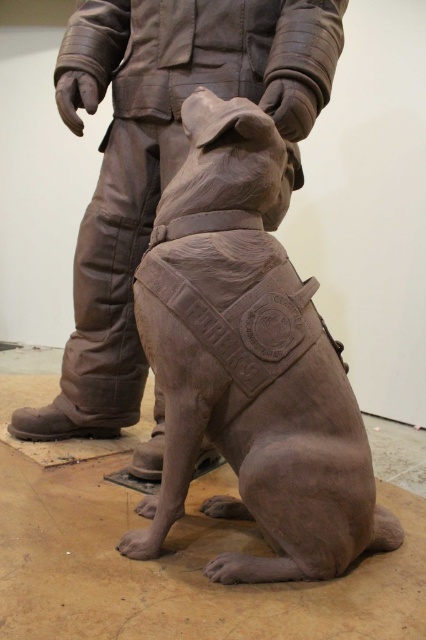
Question: Can you confirm if matte clay dog at center is wider than matte bronze dog at center?

Choices:
 (A) no
 (B) yes

Answer: (A)

Question: Is matte clay dog at center in front of matte bronze dog at center?

Choices:
 (A) yes
 (B) no

Answer: (A)

Question: Can you confirm if matte clay dog at center is positioned to the left of matte bronze dog at center?

Choices:
 (A) no
 (B) yes

Answer: (A)

Question: Which point appears farthest from the camera in this image?

Choices:
 (A) (66, 51)
 (B) (365, 502)

Answer: (A)

Question: Among these points, which one is farthest from the camera?

Choices:
 (A) click(334, 536)
 (B) click(282, 67)

Answer: (B)